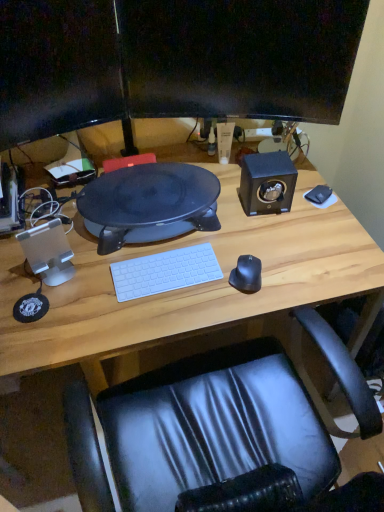
Find the location of a particular element. The image size is (384, 512). free point below white matte keyboard at center (from a real-world perspective) is located at coordinates (165, 279).